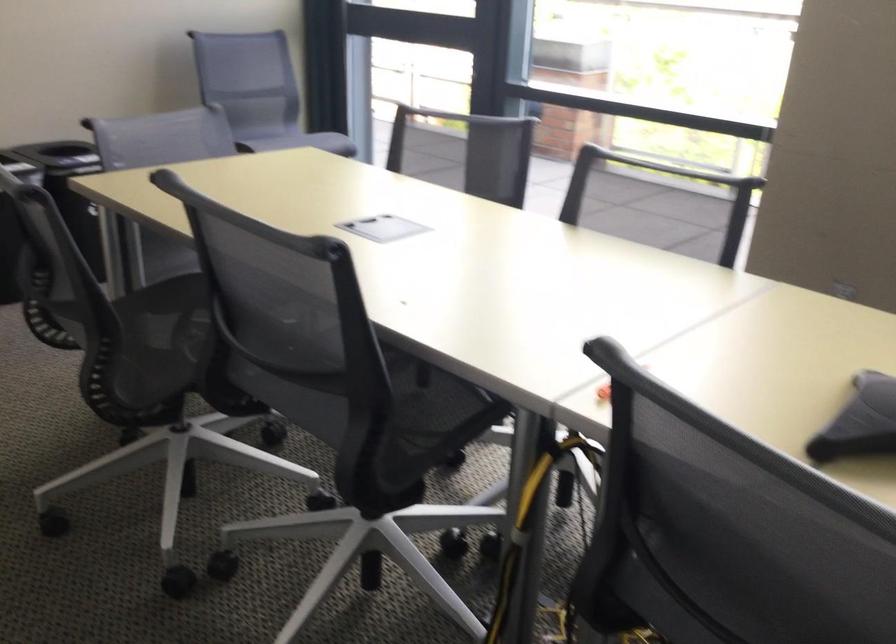
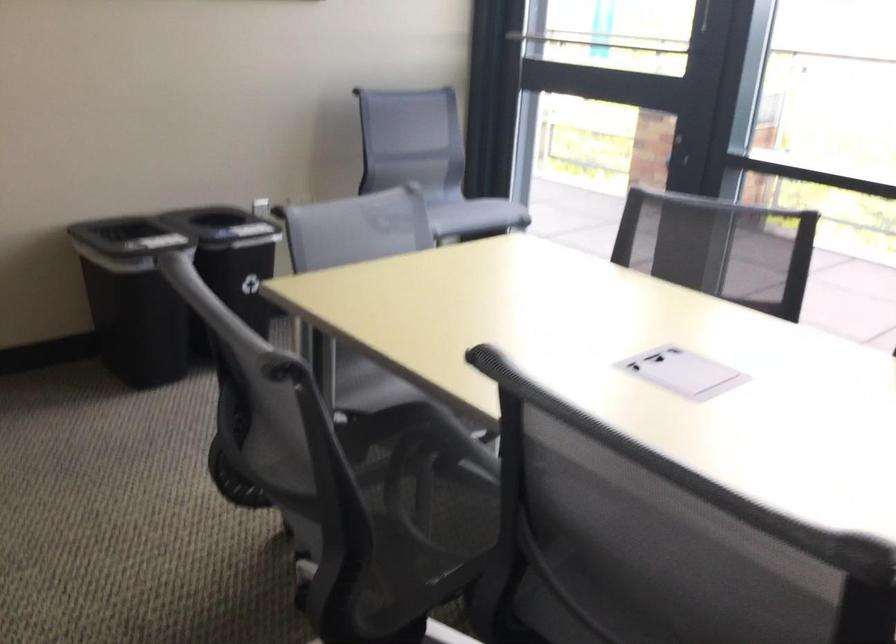
Locate, in the second image, the point that corresponds to pixel 168 279 in the first image.

(350, 399)